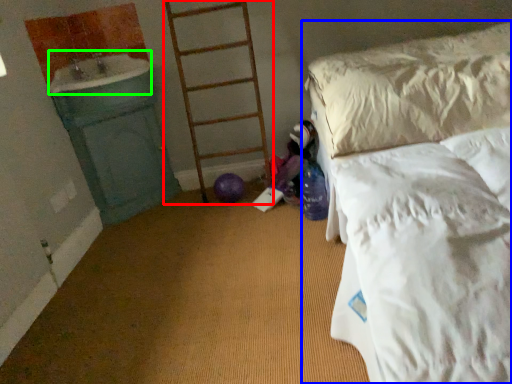
Question: Which object is the closest to the ladder (highlighted by a red box)? Choose among these: bed (highlighted by a blue box) or sink (highlighted by a green box).

Choices:
 (A) bed
 (B) sink

Answer: (B)